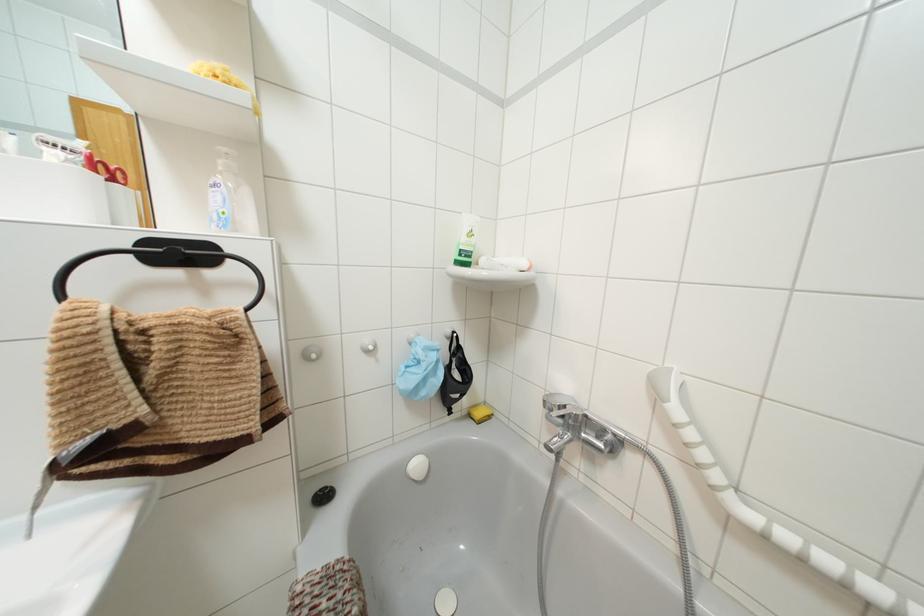
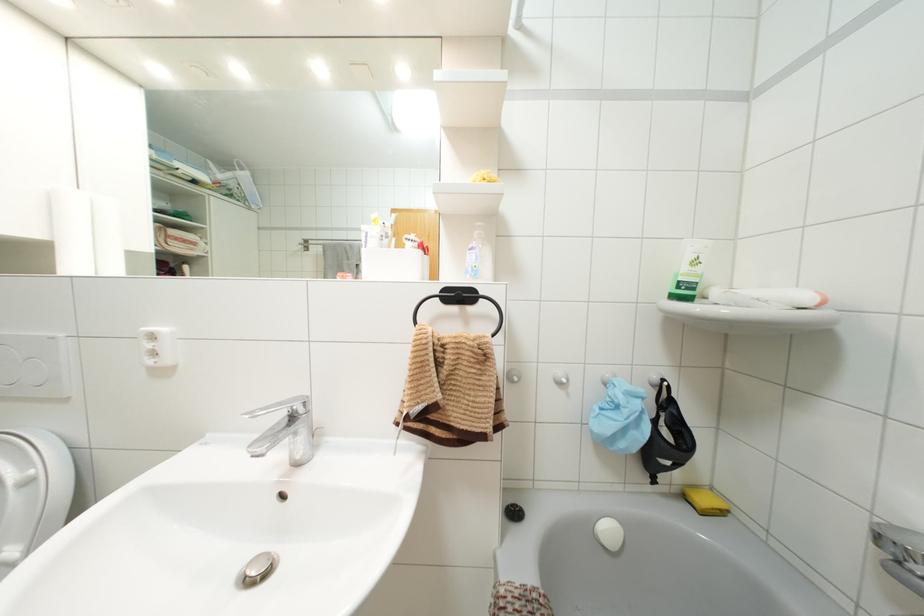
Locate, in the second image, the point that corresponds to (x=367, y=351) in the first image.

(558, 383)